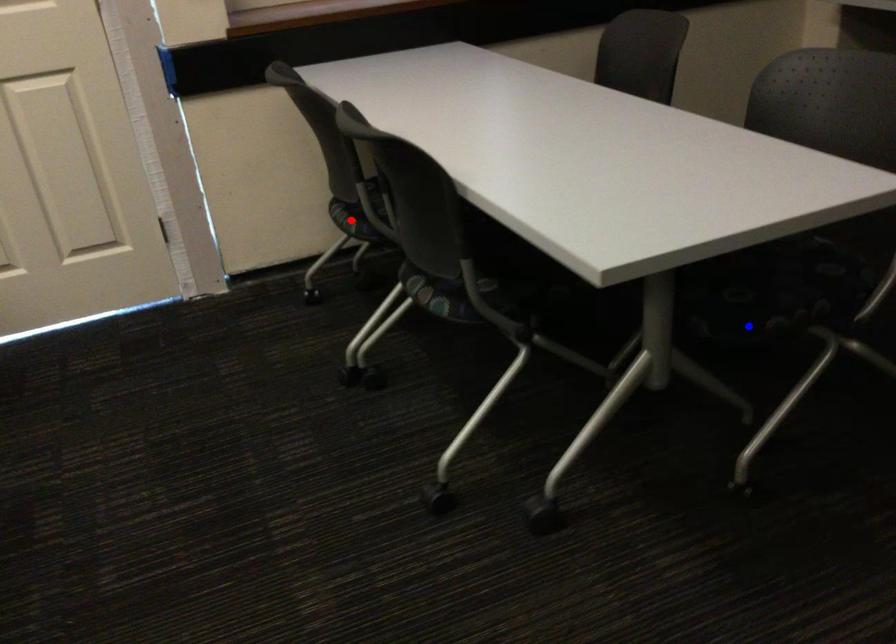
Question: In the image, two points are highlighted. Which point is nearer to the camera? Reply with the corresponding letter.

Choices:
 (A) blue point
 (B) red point

Answer: (A)